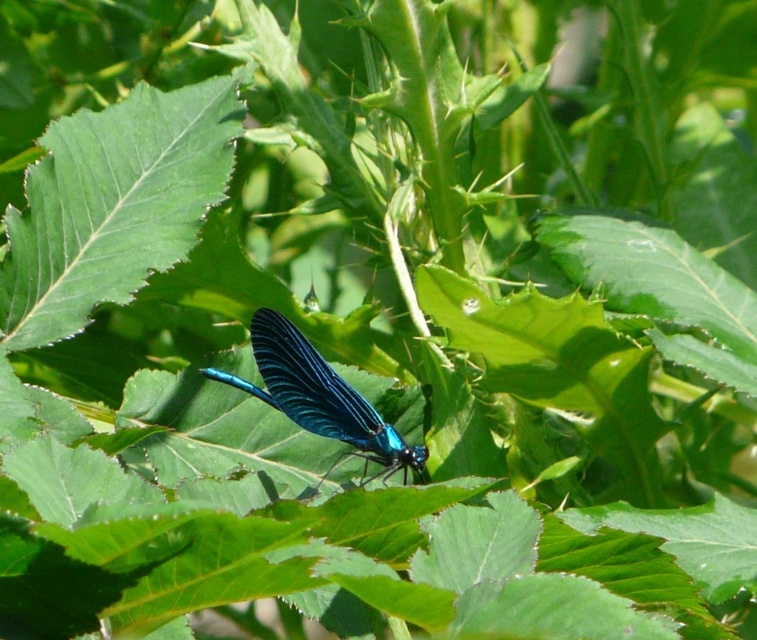
Question: Is green smooth leaf at center behind glossy metallic blue dragonfly at center?

Choices:
 (A) yes
 (B) no

Answer: (A)

Question: Which of the following is the farthest from the observer?

Choices:
 (A) (215, 83)
 (B) (256, 387)

Answer: (A)

Question: Is green smooth leaf at center further to camera compared to glossy metallic blue dragonfly at center?

Choices:
 (A) no
 (B) yes

Answer: (B)

Question: Can you confirm if green smooth leaf at center is positioned above glossy metallic blue dragonfly at center?

Choices:
 (A) no
 (B) yes

Answer: (B)

Question: Which point is closer to the camera?

Choices:
 (A) glossy metallic blue dragonfly at center
 (B) green smooth leaf at center

Answer: (A)